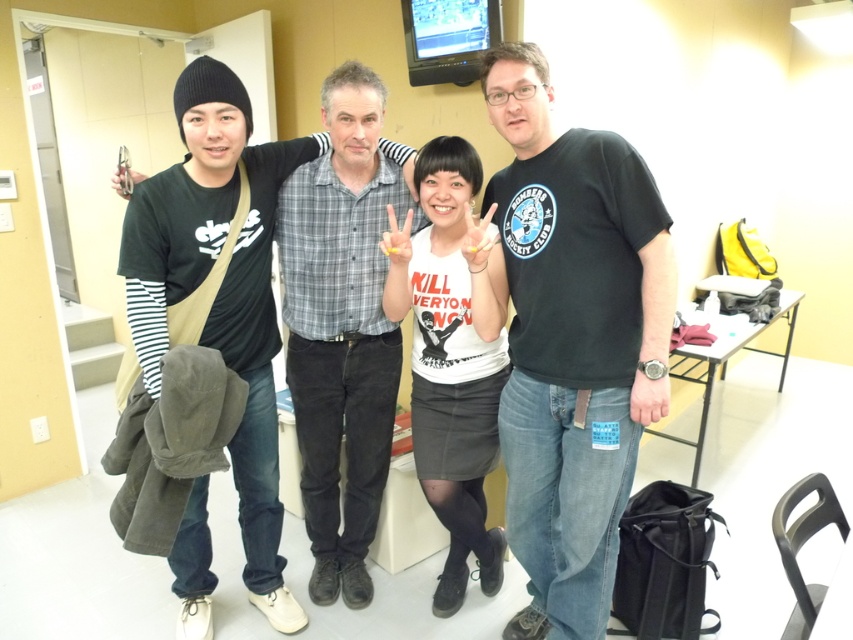
You are a photographer trying to adjust the lighting in the scene. You notice two shirts in the center of the image, the gray plaid shirt at center and the white matte shirt at center. Which shirt is positioned higher in the frame?

The gray plaid shirt at center is located above the white matte shirt at center, so it is positioned higher in the frame.

You are standing in front of the group photo and want to determine which of the two points, point [503,448] or point [457,144], is nearer to you. Based on the image, which point is closer?

Point [503,448] is closer to the viewer than point [457,144].